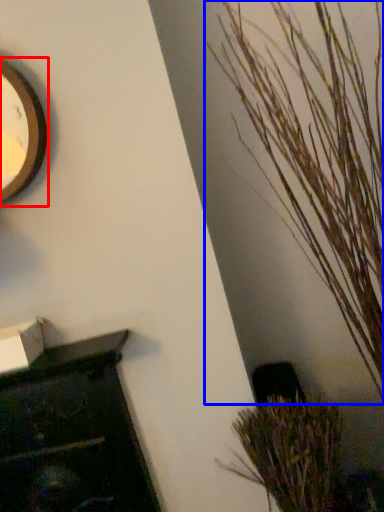
Question: Which of the following is the farthest to the observer, clock (highlighted by a red box) or houseplant (highlighted by a blue box)?

Choices:
 (A) clock
 (B) houseplant

Answer: (A)